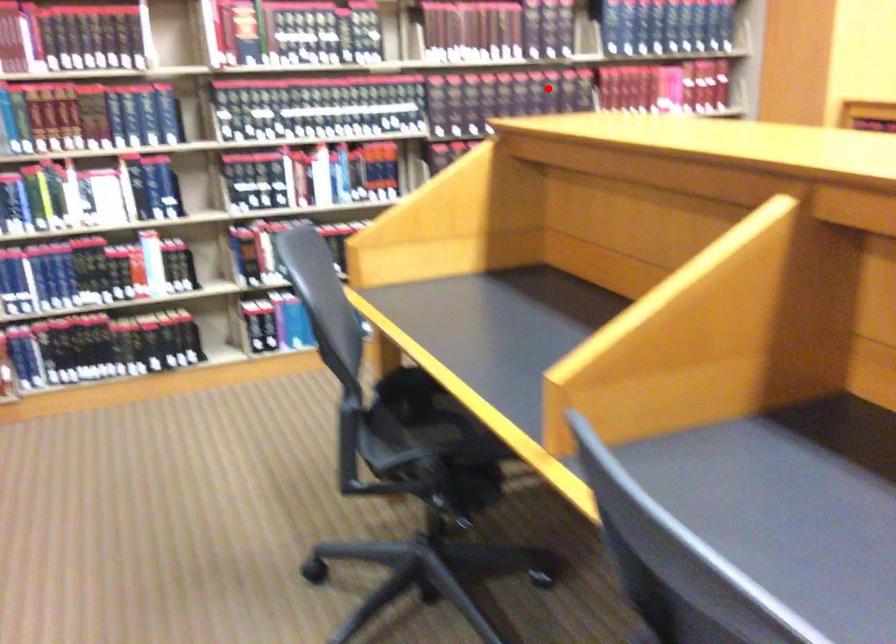
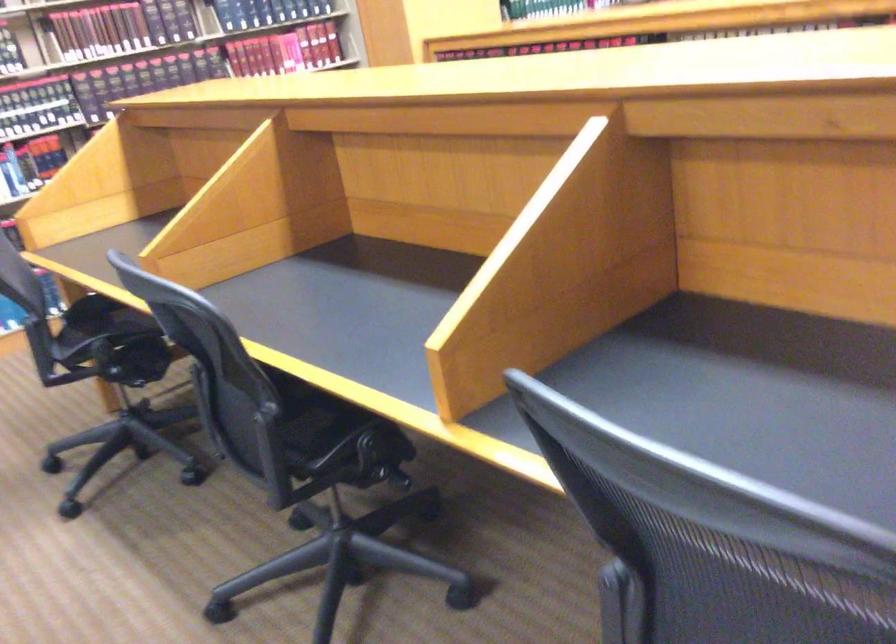
Question: A red point is marked in image1. In image2, is the corresponding 3D point closer to the camera or farther? Reply with the corresponding letter.

Choices:
 (A) The corresponding 3D point is closer.
 (B) The corresponding 3D point is farther.

Answer: (B)